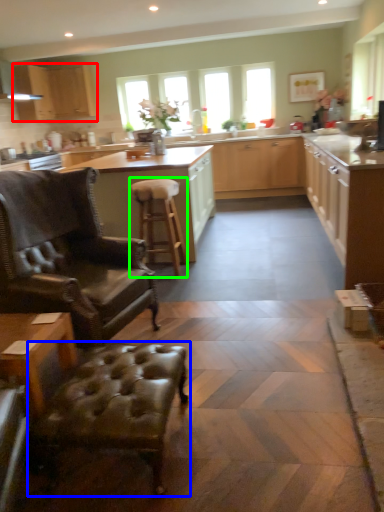
Question: Which object is the closest to the cabinetry (highlighted by a red box)? Choose among these: swivel chair (highlighted by a blue box) or stool (highlighted by a green box).

Choices:
 (A) swivel chair
 (B) stool

Answer: (B)